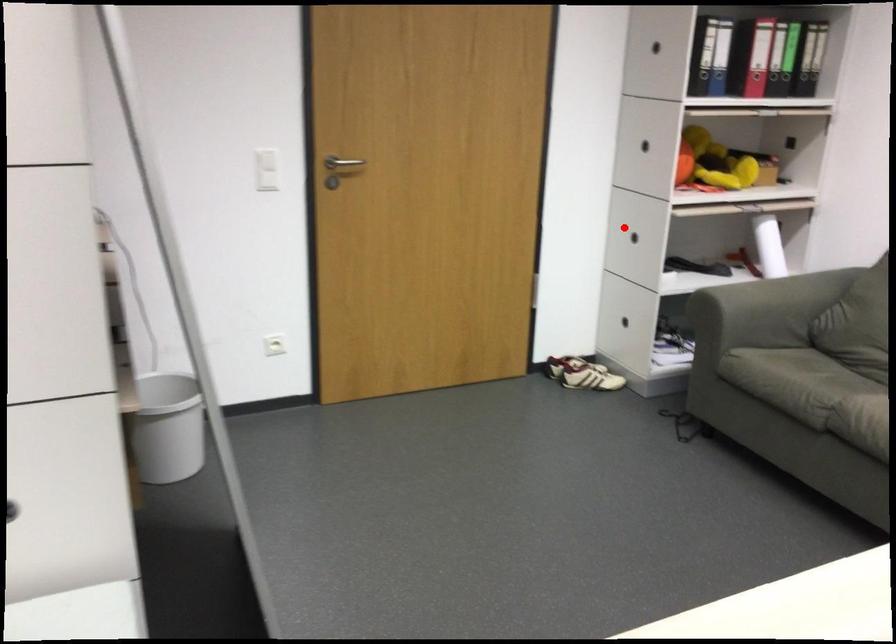
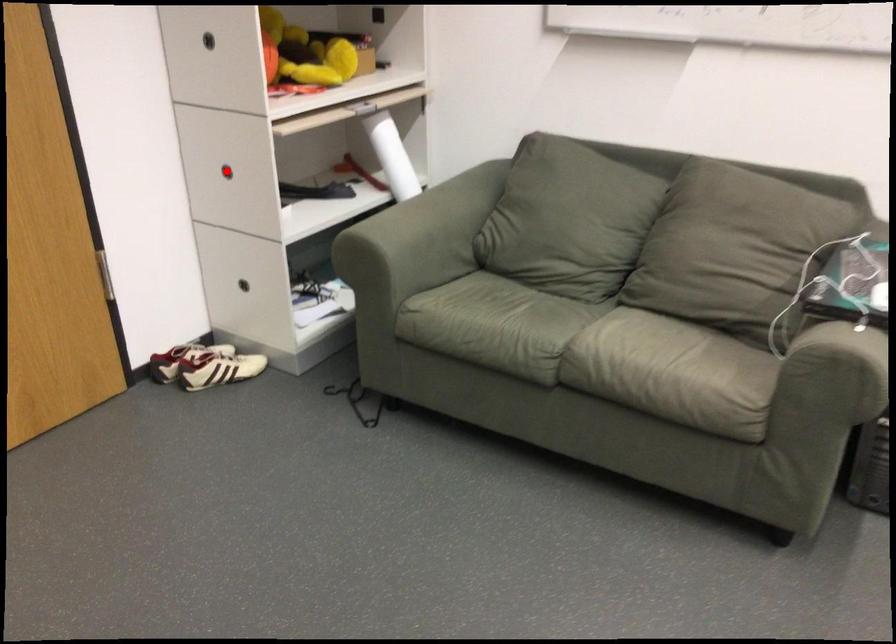
I am providing you with two images of the same scene from different viewpoints. A red point is marked on the first image and another point is marked on the second image. Is the red point in image1 aligned with the point shown in image2?

Yes